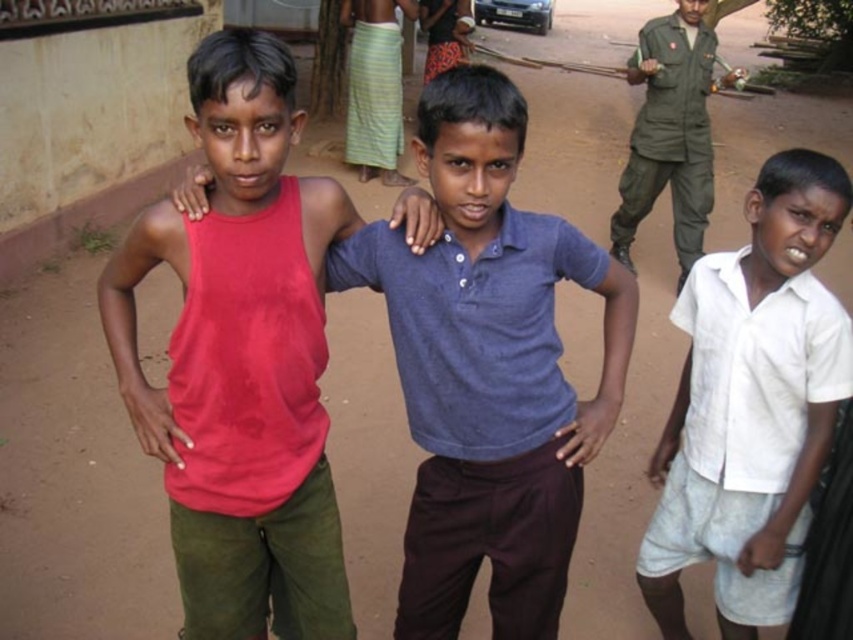
You are a photographer trying to arrange the three boys for a group photo. The boys are wearing the matte red tank top at center and the white cotton shirt at right. You need to ensure that the larger clothing item is placed in the middle of the frame for balance. Based on their current positions, is the larger clothing item already in the middle?

The matte red tank top at center is larger in size than the white cotton shirt at right, so the larger clothing item is already positioned in the middle of the frame.

You are a photographer trying to arrange the three boys in a line for a photo. The blue cotton shirt at center and the white cotton shirt at right must be included. Considering their sizes, which boy should stand where to ensure the largest boy is in the middle?

The blue cotton shirt at center is bigger than the white cotton shirt at right, so the boy in the blue cotton shirt at center should be placed in the middle to ensure the largest boy is in the middle.

You are a photographer trying to capture a group photo of three boys standing on a dirt road. You notice a specific point marked at coordinates point (303,625). Based on the scene description, can you determine if this point is within a safe distance for the camera to focus on the boys?

The point (303,625) is 1.99 meters away from the camera, which is a safe distance for focusing on the boys since it is close enough to ensure clarity without being too far or too near.